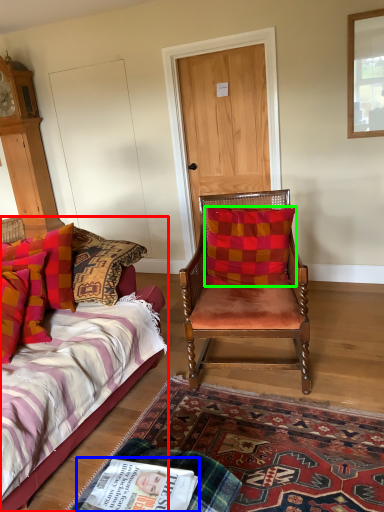
Question: Based on their relative distances, which object is nearer to bed (highlighted by a red box)? Choose from magazine (highlighted by a blue box) and pillow (highlighted by a green box).

Choices:
 (A) magazine
 (B) pillow

Answer: (A)